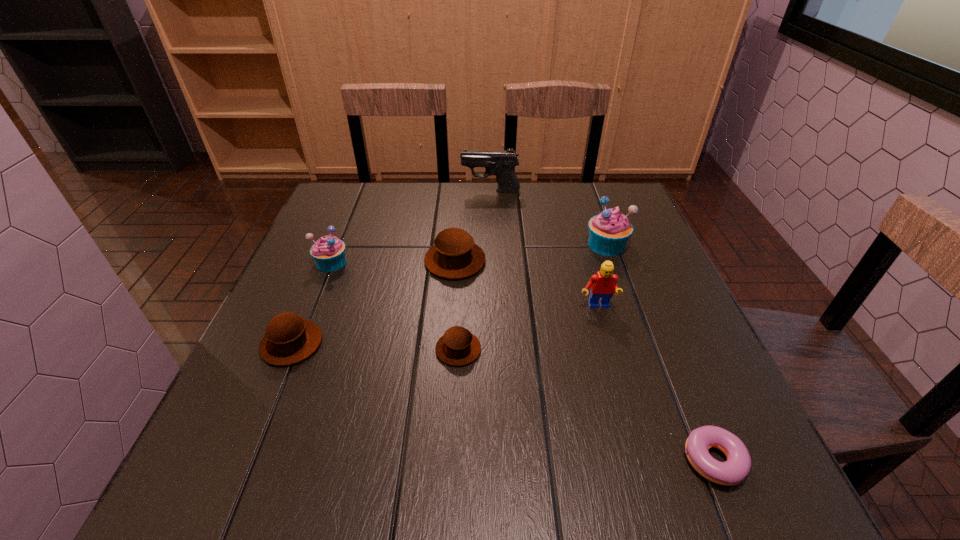
I want to click on vacant area that lies between the rightmost muffin and the biggest brown muffin, so click(x=531, y=253).

At what (x,y) coordinates should I click in order to perform the action: click on free spot between the third shortest object and the biggest brown muffin. Please return your answer as a coordinate pair (x, y). The height and width of the screenshot is (540, 960). Looking at the image, I should click on (373, 302).

Locate an element on the screen. This screenshot has width=960, height=540. unoccupied position between the doughnut and the tallest muffin is located at coordinates (658, 353).

I want to click on vacant space that's between the biggest brown muffin and the fourth tallest muffin, so click(373, 302).

Identify the location of free area in between the left blue muffin and the pistol. The image size is (960, 540). [x=411, y=227].

Where is `empty location between the rightmost muffin and the biggest brown muffin`? The width and height of the screenshot is (960, 540). empty location between the rightmost muffin and the biggest brown muffin is located at coordinates (531, 253).

Locate an element on the screen. This screenshot has height=540, width=960. object that stands as the sixth closest to the third shortest object is located at coordinates (x=609, y=231).

Select which object appears as the fifth closest to the red Lego. Please provide its 2D coordinates. Your answer should be formatted as a tuple, i.e. [(x, y)], where the tuple contains the x and y coordinates of a point satisfying the conditions above.

[(500, 163)]

Find the location of a particular element. the third closest muffin to the smaller blue muffin is located at coordinates 458,346.

At what (x,y) coordinates should I click in order to perform the action: click on muffin identified as the third closest to the shortest muffin. Please return your answer as a coordinate pair (x, y). Looking at the image, I should click on (328, 252).